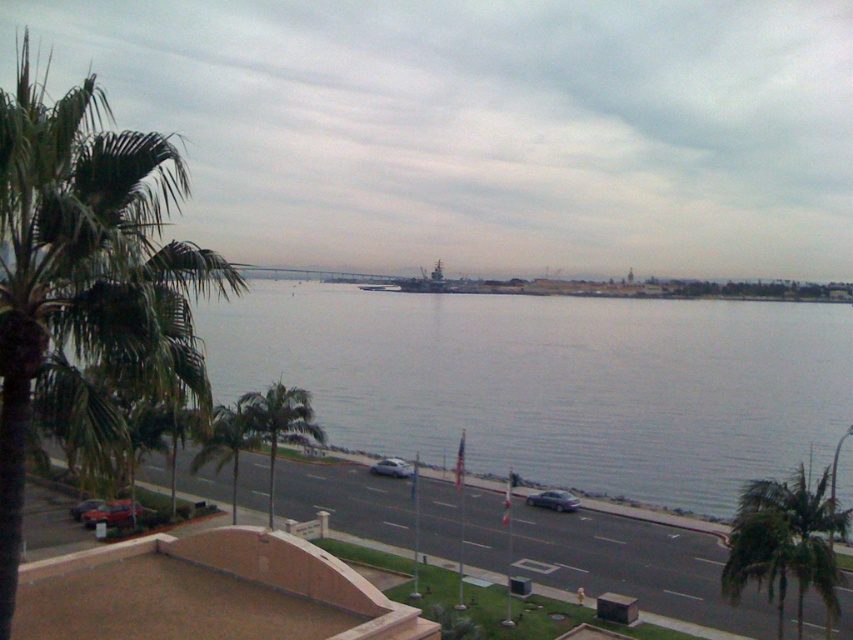
Based on the photo, you are standing at the point marked as point (225, 444) in the image. What object is located exactly at that point?

The green leafy palm tree at lower center is located exactly at point (225, 444).

You are a pedestrian standing on the paved road and want to walk from the metallic silver car at lower left to the green leafy palm tree at lower center. Which direction should you face to walk directly towards it?

Since the green leafy palm tree at lower center is positioned on the right side of metallic silver car at lower left, you should face towards the right direction to walk directly towards it.

You are standing at the waterfront scene and want to take a photo. There are two points marked in the image. The first point is at coordinate point (416, 442) and the second is at point (126, 316). If you want to focus on the point that is closer to you, which coordinate should you aim your camera at?

You should aim your camera at point (126, 316) because it is closer to you than point (416, 442).